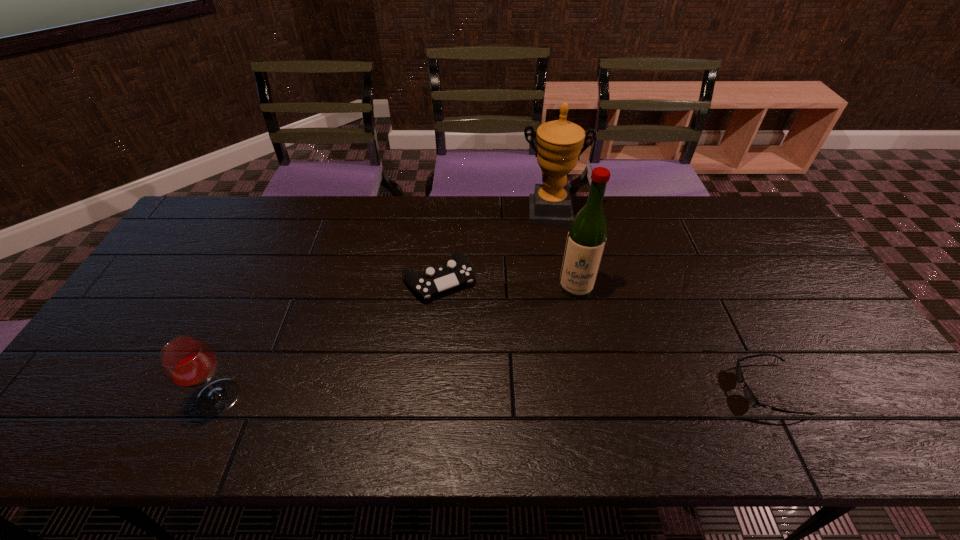
Where is `free space between the liquor and the shortest object`? The image size is (960, 540). free space between the liquor and the shortest object is located at coordinates (672, 338).

Locate an element on the screen. unoccupied area between the wineglass and the fourth tallest object is located at coordinates (328, 339).

Image resolution: width=960 pixels, height=540 pixels. In order to click on vacant space that is in between the shortest object and the award in this screenshot , I will do `click(659, 301)`.

Identify the location of free space between the farthest object and the leftmost object. This screenshot has width=960, height=540. (384, 305).

Identify the location of vacant region between the farthest object and the liquor. (563, 249).

The image size is (960, 540). In order to click on free space between the control and the liquor in this screenshot , I will do `click(507, 283)`.

This screenshot has height=540, width=960. I want to click on vacant region between the fourth tallest object and the rightmost object, so click(603, 334).

Where is `free space between the shortest object and the liquor`? free space between the shortest object and the liquor is located at coordinates [x=672, y=338].

Where is `vacant space that's between the wineglass and the shortest object`? This screenshot has height=540, width=960. vacant space that's between the wineglass and the shortest object is located at coordinates (492, 393).

Where is `object that is the nearest to the second shortest object`? This screenshot has height=540, width=960. object that is the nearest to the second shortest object is located at coordinates (559, 142).